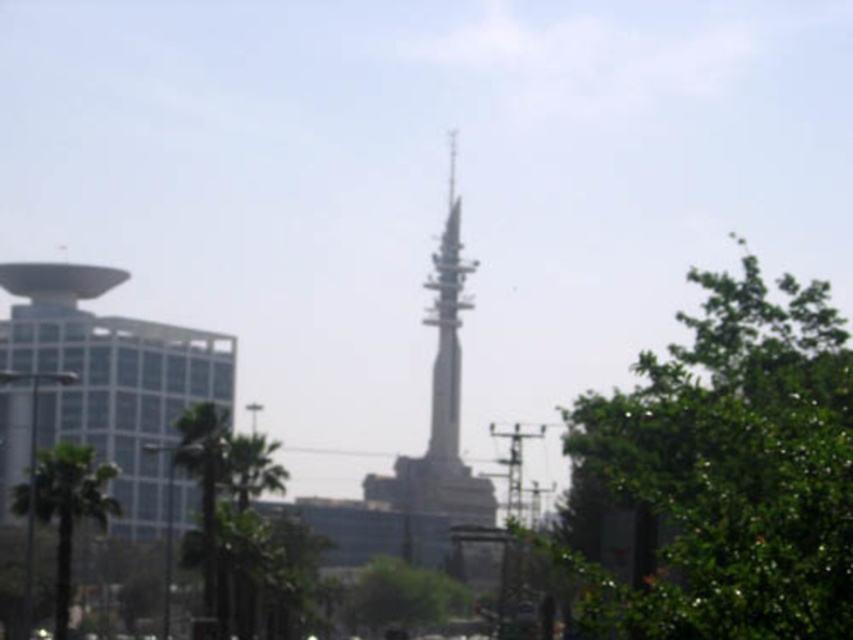
Question: Is metallic spire at center bigger than green leafy tree at center?

Choices:
 (A) yes
 (B) no

Answer: (A)

Question: Among these objects, which one is nearest to the camera?

Choices:
 (A) white glass building at left
 (B) green leafy tree at center
 (C) green leafy tree at right
 (D) metallic silver tower at center

Answer: (C)

Question: Does metallic spire at center have a smaller size compared to green leafy tree at center?

Choices:
 (A) no
 (B) yes

Answer: (A)

Question: Which of the following is the farthest from the observer?

Choices:
 (A) (683, 513)
 (B) (439, 355)
 (C) (74, 291)
 (D) (97, 493)

Answer: (B)

Question: Which point is closer to the camera?

Choices:
 (A) (744, 266)
 (B) (412, 461)

Answer: (A)

Question: Observing the image, what is the correct spatial positioning of metallic spire at center in reference to green leafy tree at lower left?

Choices:
 (A) right
 (B) left

Answer: (A)